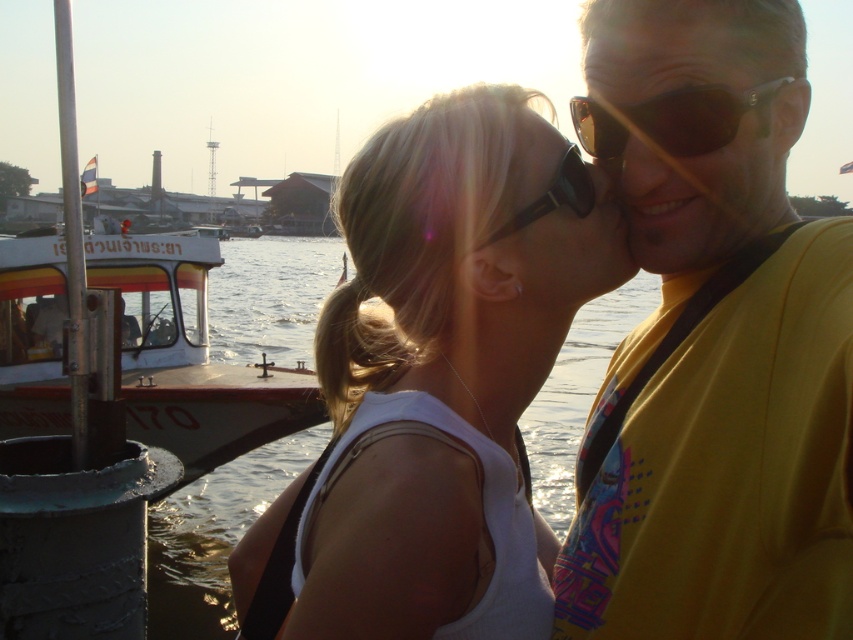
Is matte yellow shirt at upper right wider than sunglasses at center?

Indeed, matte yellow shirt at upper right has a greater width compared to sunglasses at center.

Find the location of a particular element. The image size is (853, 640). matte yellow shirt at upper right is located at coordinates (699, 154).

Where is `matte yellow shirt at upper right`? matte yellow shirt at upper right is located at coordinates (699, 154).

Is white matte tank top at center above sunglasses at center?

Actually, white matte tank top at center is below sunglasses at center.

Does white matte tank top at center appear under sunglasses at center?

Yes, white matte tank top at center is below sunglasses at center.

Locate an element on the screen. The image size is (853, 640). white matte tank top at center is located at coordinates (440, 376).

Who is taller, matte yellow shirt at upper right or sunglasses at upper right?

With more height is matte yellow shirt at upper right.

Is matte yellow shirt at upper right positioned at the back of sunglasses at upper right?

Yes.

Between point (608, 86) and point (691, 92), which one is positioned in front?

Positioned in front is point (691, 92).

Locate an element on the screen. matte yellow shirt at upper right is located at coordinates (699, 154).